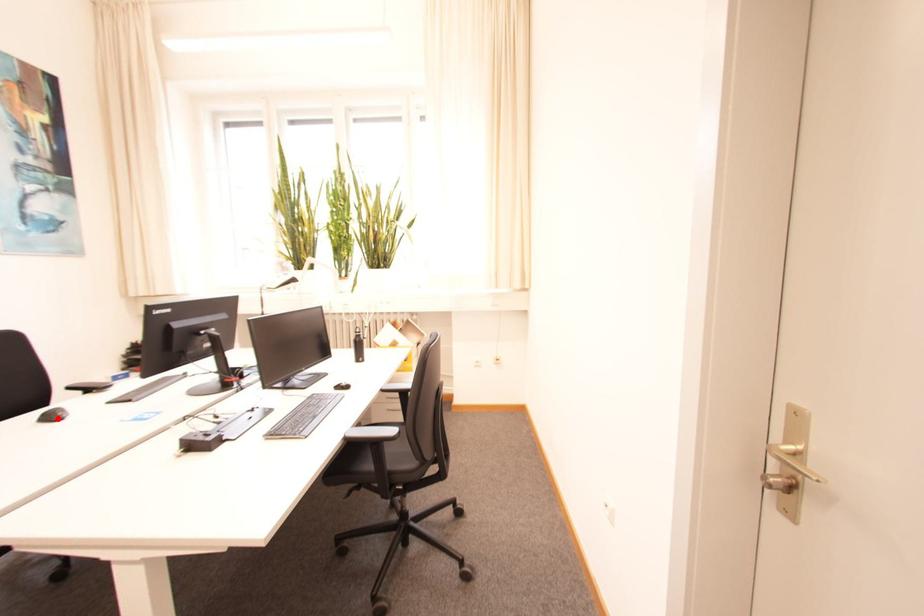
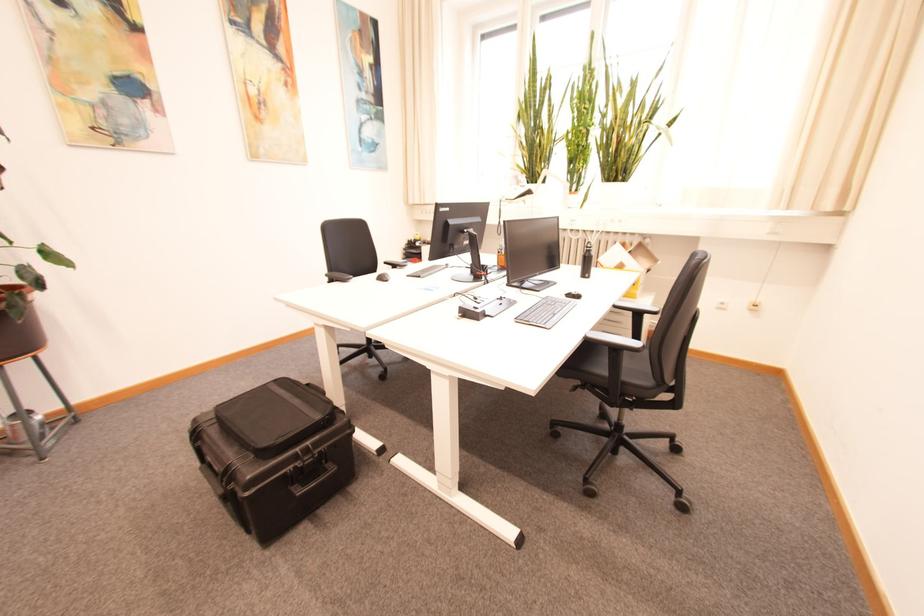
Where in the second image is the point corresponding to the highlighted location from the first image?

(388, 280)